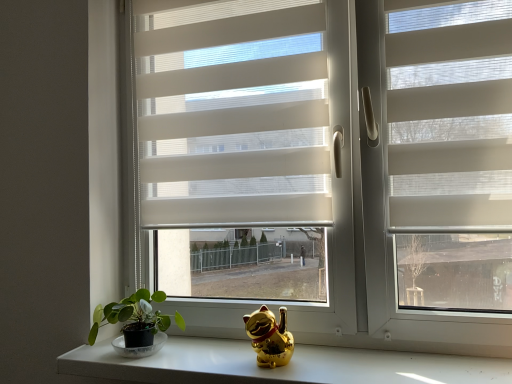
Find the location of a particular element. Image resolution: width=512 pixels, height=384 pixels. vacant region under white matte window at center (from a real-world perspective) is located at coordinates (327, 357).